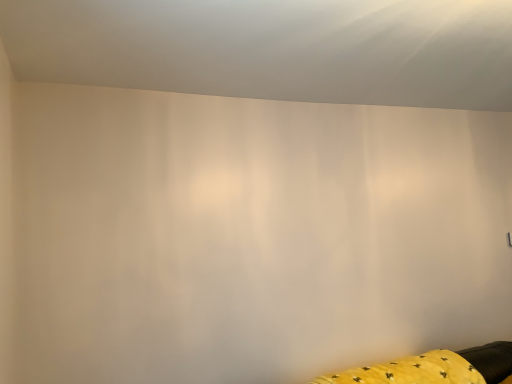
The height and width of the screenshot is (384, 512). What do you see at coordinates (435, 368) in the screenshot?
I see `yellow fabric cushion at lower right` at bounding box center [435, 368].

Locate an element on the screen. This screenshot has height=384, width=512. yellow fabric cushion at lower right is located at coordinates (435, 368).

Where is `yellow fabric cushion at lower right`? Image resolution: width=512 pixels, height=384 pixels. yellow fabric cushion at lower right is located at coordinates click(x=435, y=368).